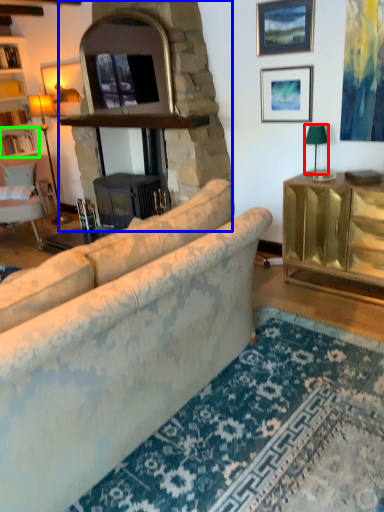
Question: Based on their relative distances, which object is nearer to lamp (highlighted by a red box)? Choose from fireplace (highlighted by a blue box) and shelf (highlighted by a green box).

Choices:
 (A) fireplace
 (B) shelf

Answer: (A)